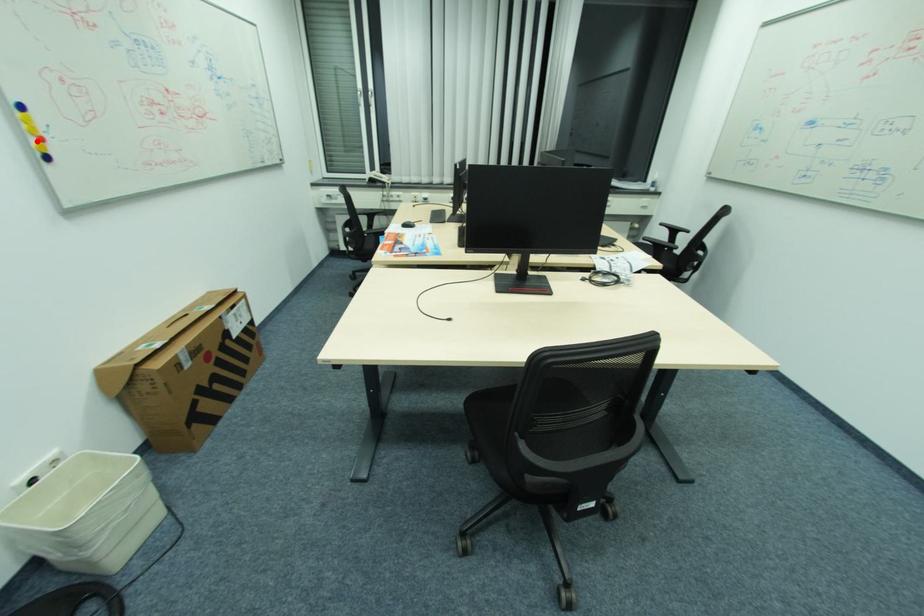
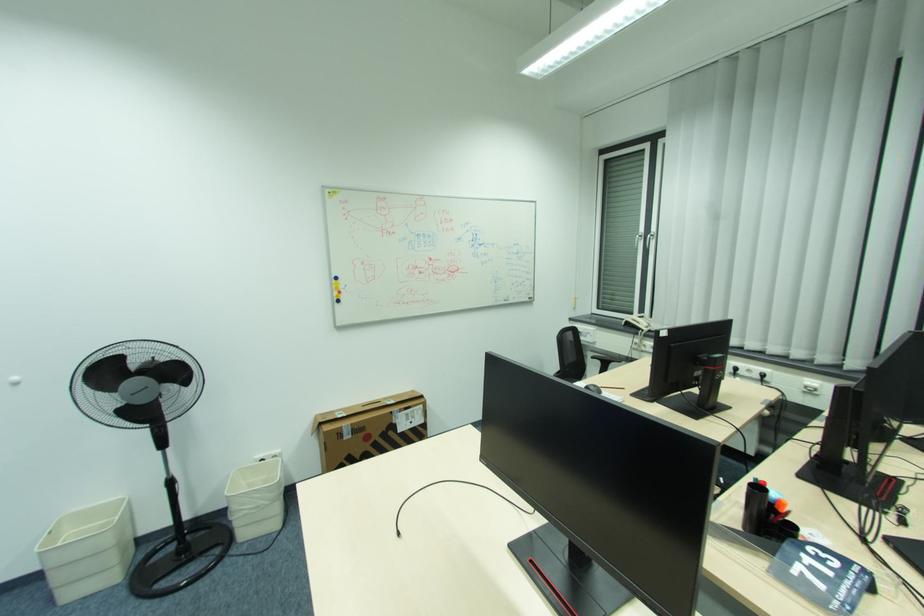
Question: I am providing you with two images of the same scene from different viewpoints. Image1 has a red point marked. In image2, the corresponding 3D location appears at what relative position? Reply with the corresponding letter.

Choices:
 (A) Closer
 (B) Farther

Answer: (A)